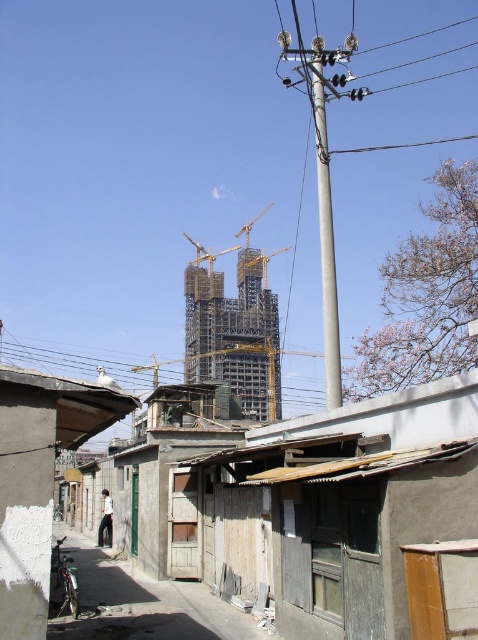
Can you confirm if metallic bicycle at lower left is positioned to the left of silver metallic motorcycle at lower left?

No, metallic bicycle at lower left is not to the left of silver metallic motorcycle at lower left.

Does metallic bicycle at lower left appear under silver metallic motorcycle at lower left?

Correct, metallic bicycle at lower left is located below silver metallic motorcycle at lower left.

Is point (79, 548) closer to viewer compared to point (65, 572)?

That is False.

Locate an element on the screen. The height and width of the screenshot is (640, 478). metallic bicycle at lower left is located at coordinates (143, 604).

Is metallic bicycle at lower left positioned at the back of gray metallic pole at center?

No.

Who is more forward, (83, 621) or (318, 186)?

Positioned in front is point (83, 621).

What are the coordinates of `metallic bicycle at lower left` in the screenshot? It's located at pyautogui.click(x=143, y=604).

Does metallic scaffolding tower at center appear under silver metallic motorcycle at lower left?

Actually, metallic scaffolding tower at center is above silver metallic motorcycle at lower left.

Consider the image. Is metallic scaffolding tower at center shorter than silver metallic motorcycle at lower left?

No, metallic scaffolding tower at center is not shorter than silver metallic motorcycle at lower left.

Locate an element on the screen. This screenshot has width=478, height=640. metallic scaffolding tower at center is located at coordinates (235, 330).